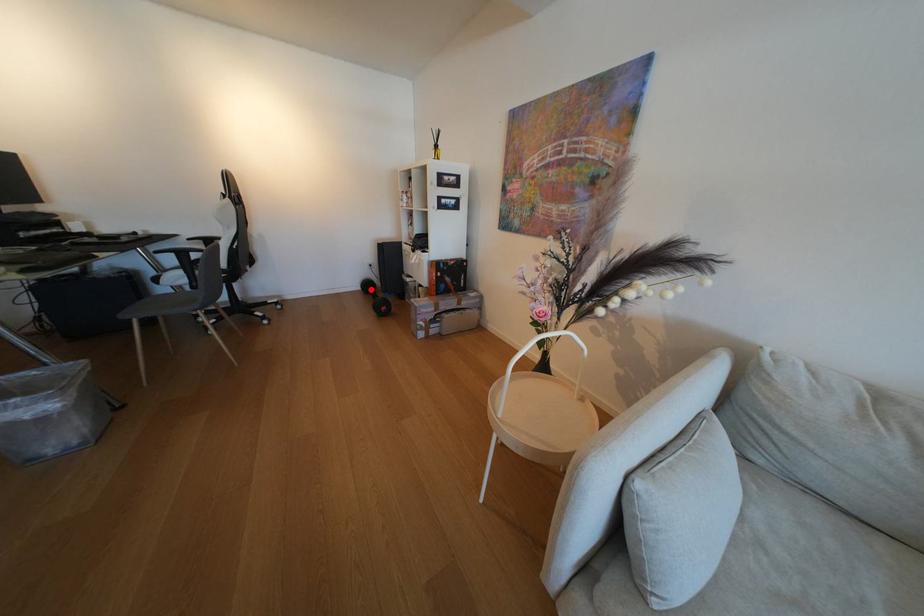
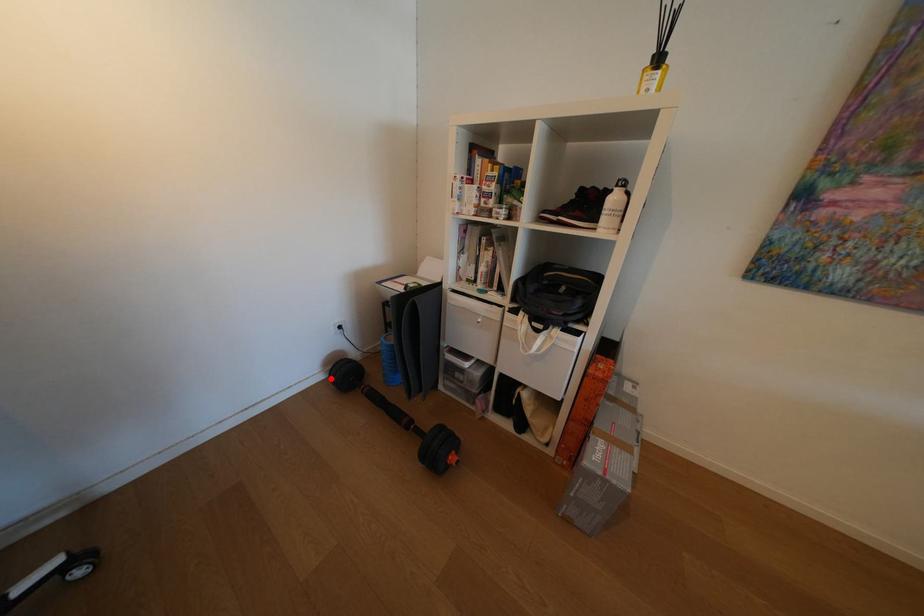
I am providing you with two images of the same scene from different viewpoints. A red point is marked on the first image and another point is marked on the second image. Do the highlighted points in image1 and image2 indicate the same real-world spot?

Yes